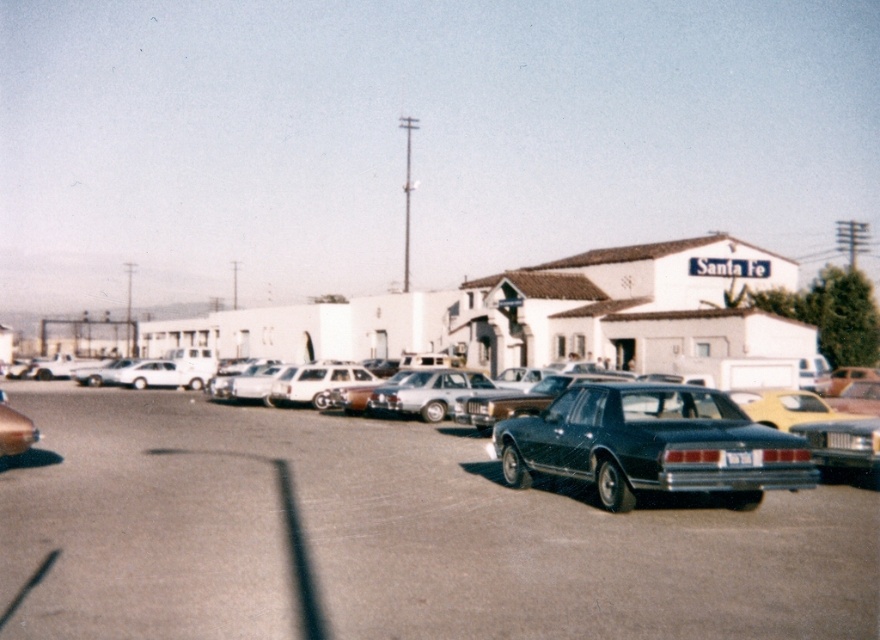
You are standing in the parking lot and want to walk to the point marked as point (495,528). How far will you have to walk?

The distance of point (495,528) from camera is 10.14 meters, so you will have to walk 10.14 meters to reach point (495,528).

You are a photographer trying to capture the shiny black car at center and the black plastic license plate at center in your shot. Which object will appear larger in your photo?

The shiny black car at center will appear larger in the photo because it is closer to the viewer than the black plastic license plate at center.

You are a delivery person who needs to load a tall package into your van. The package is 1.8 meters tall. You see the shiny black car at center and the shiny dark blue sedan at center in the parking lot. Which car should you avoid placing the package near to ensure it doesn,t get damaged?

You should avoid placing the package near the shiny dark blue sedan at center because it has a greater height than the shiny black car at center, increasing the risk of the tall package getting damaged by overhead objects.